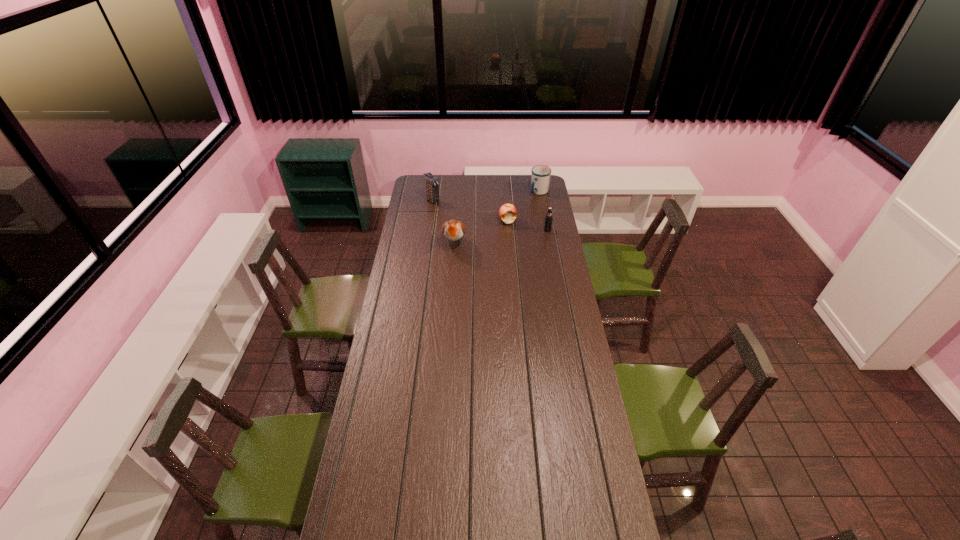
Find the location of `vacant point located between the fourth object from right to left and the shortest object`. vacant point located between the fourth object from right to left and the shortest object is located at coordinates (481, 232).

Find the location of a particular element. This screenshot has height=540, width=960. blank region between the clutch bag and the bird is located at coordinates (444, 221).

Where is `free space between the bird and the third farthest object`? The width and height of the screenshot is (960, 540). free space between the bird and the third farthest object is located at coordinates (481, 232).

At what (x,y) coordinates should I click in order to perform the action: click on free point between the pop and the mug. Please return your answer as a coordinate pair (x, y). This screenshot has width=960, height=540. Looking at the image, I should click on (543, 211).

Find the location of `vacant area between the mug and the pop`. vacant area between the mug and the pop is located at coordinates (543, 211).

Find the location of `blank region between the third farthest object and the pop`. blank region between the third farthest object and the pop is located at coordinates (527, 226).

Identify which object is the fourth nearest to the pop. Please provide its 2D coordinates. Your answer should be formatted as a tuple, i.e. [(x, y)], where the tuple contains the x and y coordinates of a point satisfying the conditions above.

[(431, 182)]

Where is `the second closest object to the clutch bag`? the second closest object to the clutch bag is located at coordinates (507, 213).

Locate an element on the screen. The height and width of the screenshot is (540, 960). free space that satisfies the following two spatial constraints: 1. on the front side of the apple; 2. on the right side of the leftmost object is located at coordinates (430, 221).